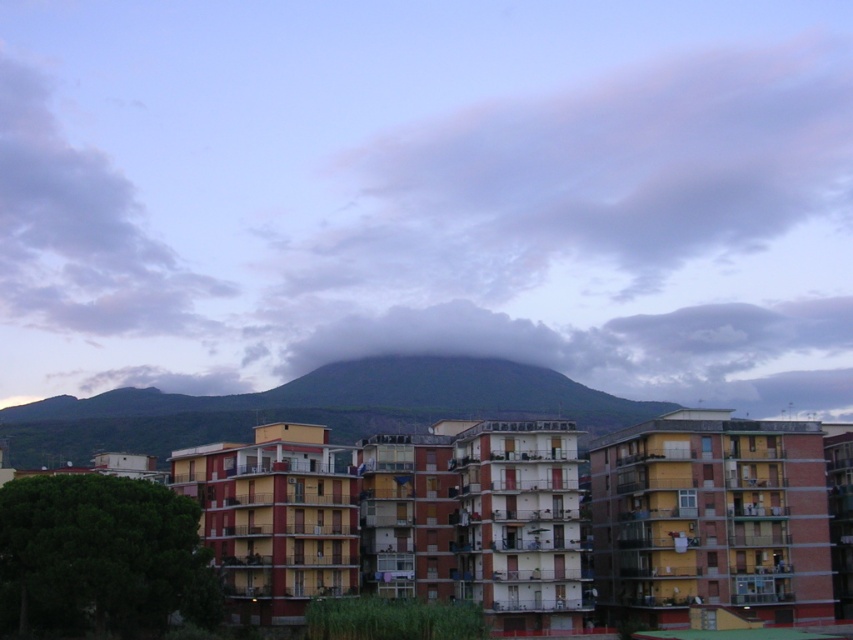
Does cloudy sky at center have a lesser width compared to dark green mountain at center?

No, cloudy sky at center is not thinner than dark green mountain at center.

Between cloudy sky at center and dark green mountain at center, which one has more height?

Standing taller between the two is cloudy sky at center.

Where is `cloudy sky at center`? The width and height of the screenshot is (853, 640). cloudy sky at center is located at coordinates (428, 193).